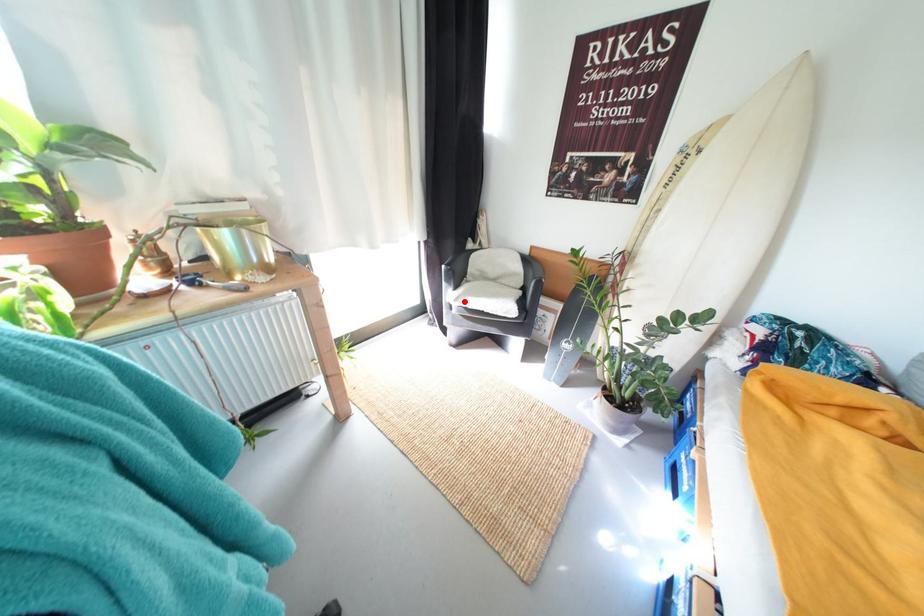
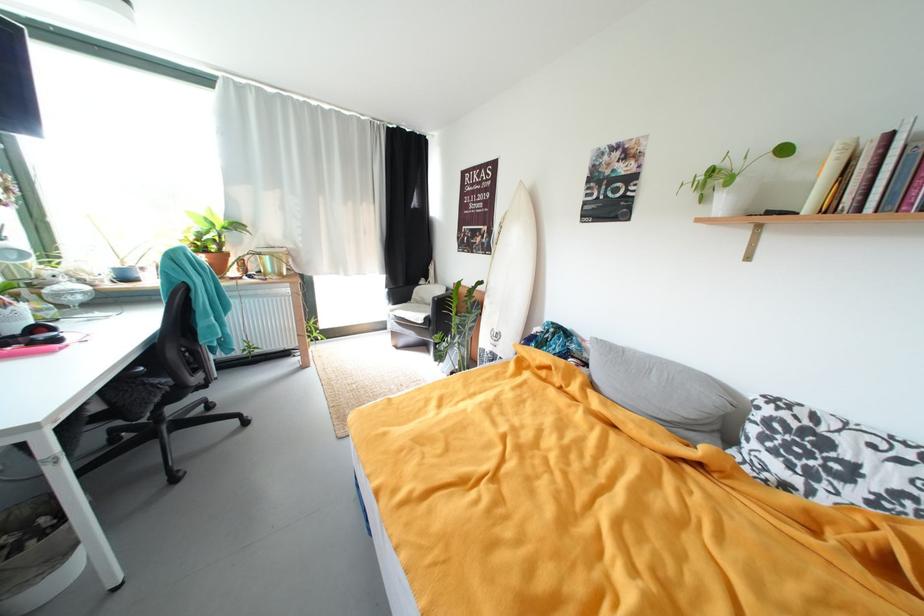
Locate, in the second image, the point that corresponds to the highlighted location in the first image.

(399, 313)